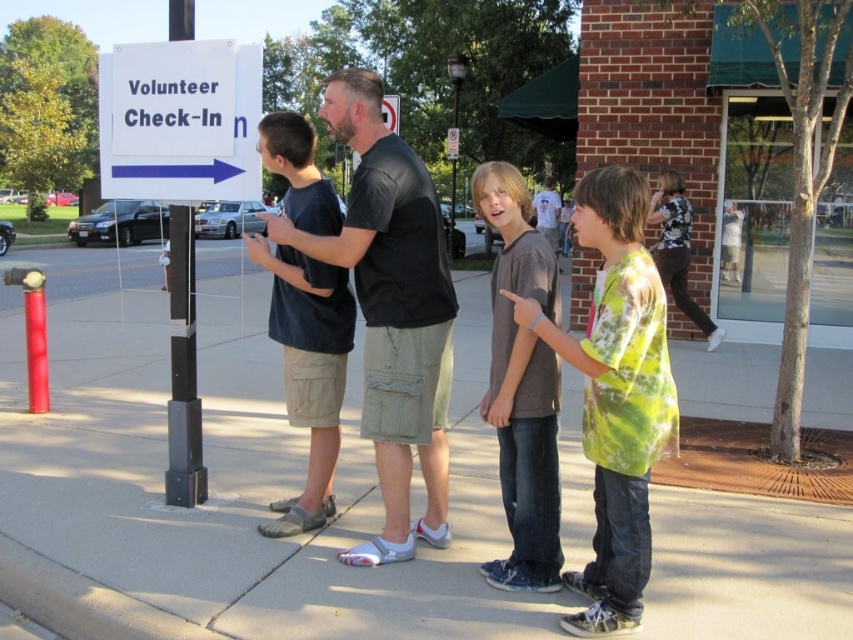
From the picture: The image shows a volunteer check in point with a group of people. There is a point at coordinates (x=392, y=310). What object is located at this point?

The point at coordinates (x=392, y=310) is located on the black leather shirt at center.